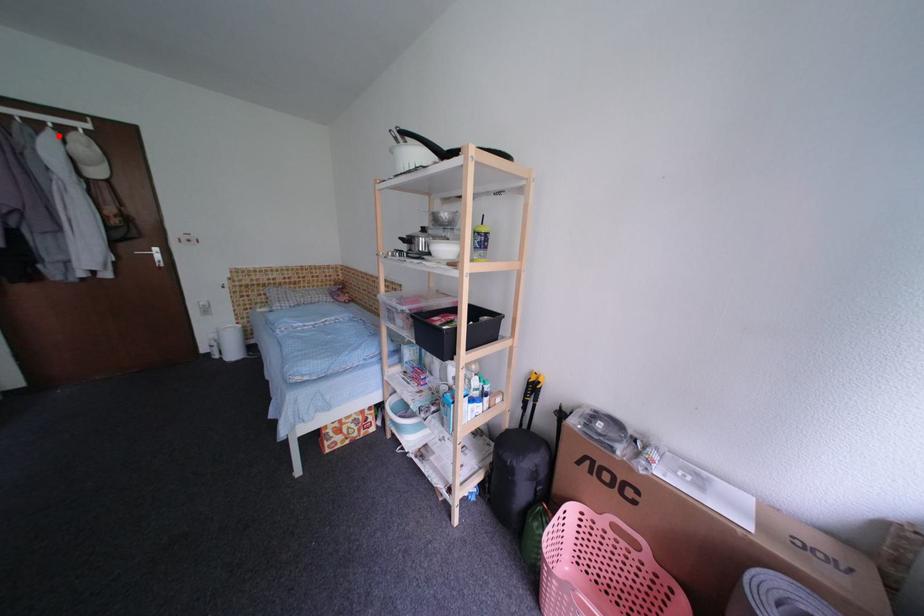
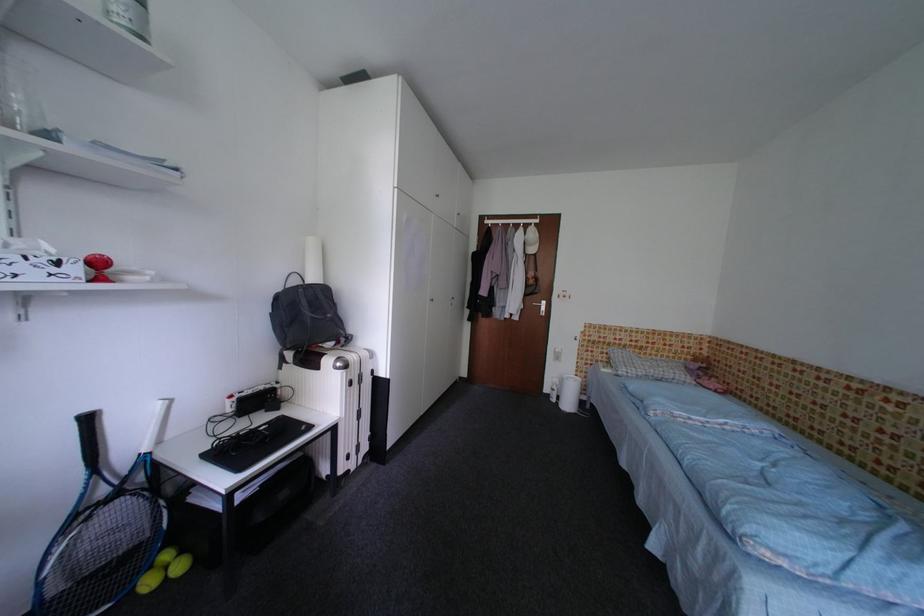
Find the pixel in the second image that matches the highlighted location in the first image.

(529, 232)